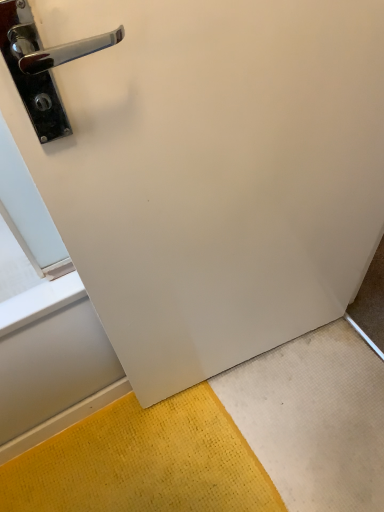
Identify the location of yellow textured mat at lower right. (143, 462).

The width and height of the screenshot is (384, 512). Describe the element at coordinates (143, 462) in the screenshot. I see `yellow textured mat at lower right` at that location.

You are a GUI agent. You are given a task and a screenshot of the screen. Output one action in this format:
    pyautogui.click(x=<x>, y=<y>)
    Task: Click on the yellow textured mat at lower right
    
    Given the screenshot: What is the action you would take?
    pyautogui.click(x=143, y=462)